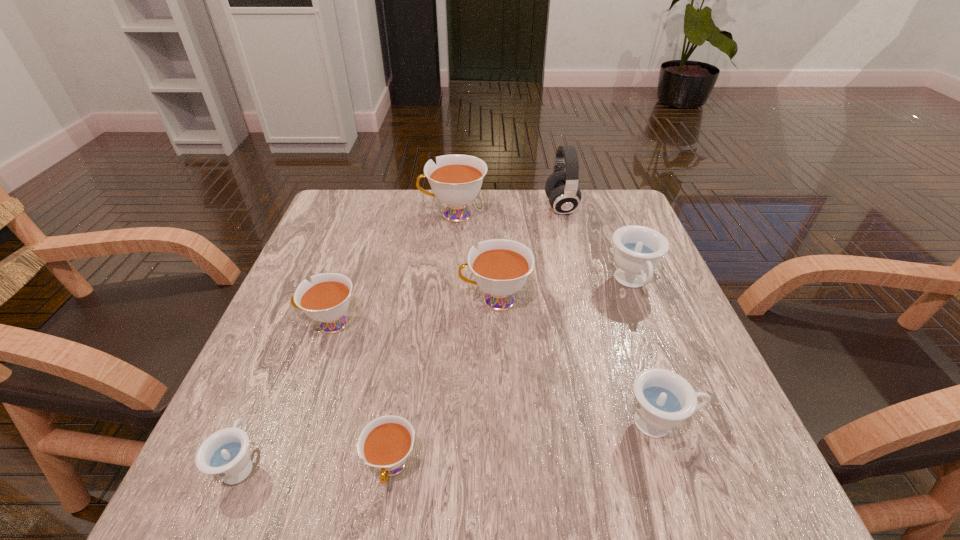
The height and width of the screenshot is (540, 960). Find the location of `vacant region at the right edge`. vacant region at the right edge is located at coordinates (720, 384).

The width and height of the screenshot is (960, 540). Find the location of `free spot at the far left corner of the desktop`. free spot at the far left corner of the desktop is located at coordinates point(360,201).

The image size is (960, 540). Identify the location of vacant space at the far right corner of the desktop. (607, 200).

Locate an element on the screen. The image size is (960, 540). vacant point at the near right corner is located at coordinates (708, 492).

You are a GUI agent. You are given a task and a screenshot of the screen. Output one action in this format:
    pyautogui.click(x=<x>, y=<y>)
    Task: Click on the empty space between the second smallest blue teacup and the farthest teacup
    This screenshot has width=960, height=540.
    Given the screenshot: What is the action you would take?
    pyautogui.click(x=557, y=319)

Image resolution: width=960 pixels, height=540 pixels. Find the location of `free space that is in between the second biggest blue teacup and the leftmost white teacup`. free space that is in between the second biggest blue teacup and the leftmost white teacup is located at coordinates (495, 373).

Identify the location of free space between the second biggest white teacup and the smallest blue teacup. The image size is (960, 540). (368, 382).

You are a GUI agent. You are given a task and a screenshot of the screen. Output one action in this format:
    pyautogui.click(x=<x>, y=<y>)
    Task: Click on the vacant region between the second biggest white teacup and the nearest white teacup
    
    Given the screenshot: What is the action you would take?
    pyautogui.click(x=444, y=383)

The image size is (960, 540). Identify the location of empty space between the biggest blue teacup and the farthest teacup. (542, 249).

This screenshot has height=540, width=960. I want to click on free space that is in between the tallest object and the second smallest white teacup, so click(x=445, y=265).